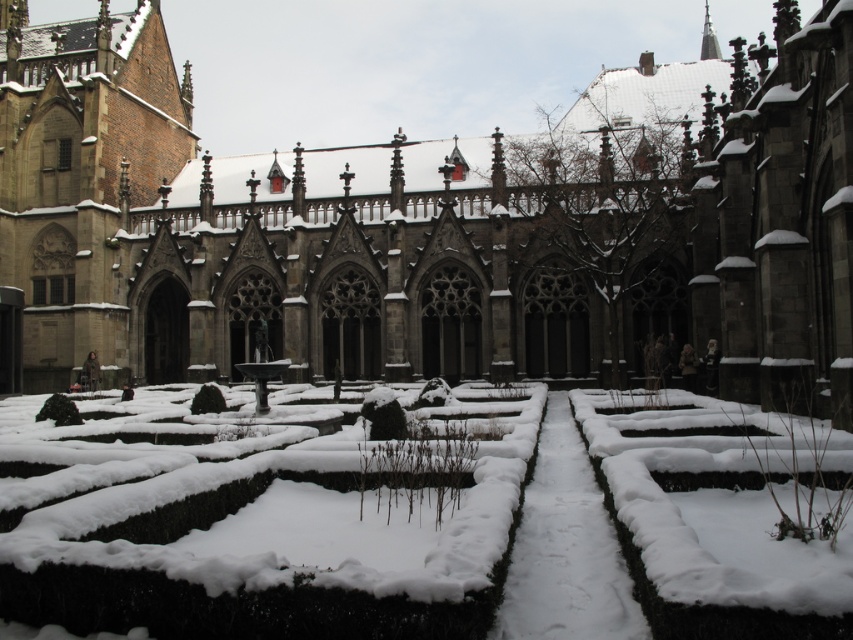
Question: Where is green leafy hedge at lower left located in relation to green matte hedge at center in the image?

Choices:
 (A) left
 (B) right

Answer: (A)

Question: Which object appears farthest from the camera in this image?

Choices:
 (A) green matte hedge at center
 (B) dark gray stone church at center

Answer: (A)

Question: Can you confirm if dark gray stone church at center is positioned to the right of green leafy hedge at lower left?

Choices:
 (A) no
 (B) yes

Answer: (B)

Question: Which is nearer to the green matte hedge at center?

Choices:
 (A) green leafy hedge at lower left
 (B) dark gray stone church at center

Answer: (A)

Question: Among these points, which one is farthest from the camera?

Choices:
 (A) pos(538,253)
 (B) pos(193,412)

Answer: (A)

Question: Is dark gray stone church at center positioned at the back of green leafy hedge at lower left?

Choices:
 (A) yes
 (B) no

Answer: (B)